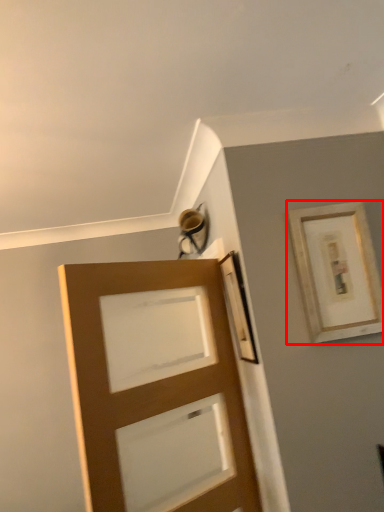
Question: From the image, what is the correct spatial relationship of picture frame (annotated by the red box) in relation to door?

Choices:
 (A) left
 (B) right

Answer: (B)